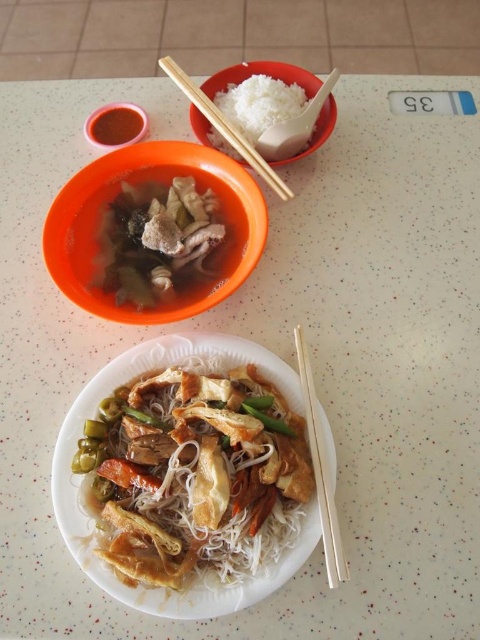
You are a diner at the table. You want to pick up the white wood chopsticks at center to eat the noodles. Can you reach them without moving the orange plastic bowl at upper center?

The white wood chopsticks at center is behind the orange plastic bowl at upper center, so you can reach them without moving the bowl.

What is the 2D coordinate of the orange plastic bowl at upper center in the image?

The orange plastic bowl at upper center is located at the 2D coordinate point of (144, 186).

What object is located at the coordinate point (321, 472) in the image?

The point (321, 472) is on white wood chopsticks at center.